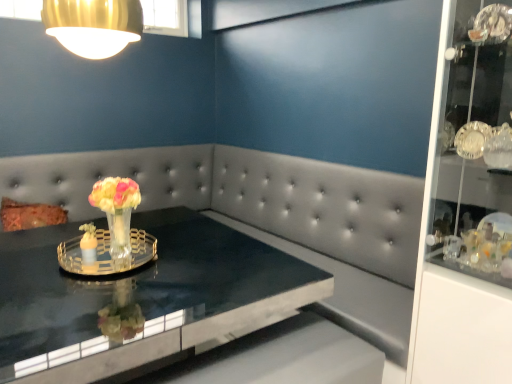
Question: Should I look upward or downward to see clear glass tray at center?

Choices:
 (A) down
 (B) up

Answer: (A)

Question: Does translucent glass vase at center have a lesser height compared to gold metallic lampshade at upper left?

Choices:
 (A) no
 (B) yes

Answer: (A)

Question: Can you see translucent glass vase at center touching gold metallic lampshade at upper left?

Choices:
 (A) yes
 (B) no

Answer: (B)

Question: Considering the relative positions of translucent glass vase at center and gold metallic lampshade at upper left in the image provided, is translucent glass vase at center to the left of gold metallic lampshade at upper left from the viewer's perspective?

Choices:
 (A) no
 (B) yes

Answer: (A)

Question: From the image's perspective, is translucent glass vase at center above gold metallic lampshade at upper left?

Choices:
 (A) yes
 (B) no

Answer: (B)

Question: Is translucent glass vase at center not close to gold metallic lampshade at upper left?

Choices:
 (A) yes
 (B) no

Answer: (B)

Question: Is translucent glass vase at center facing away from gold metallic lampshade at upper left?

Choices:
 (A) yes
 (B) no

Answer: (B)

Question: Is gold metallic lampshade at upper left not close to translucent glass vase at center?

Choices:
 (A) yes
 (B) no

Answer: (B)

Question: Is gold metallic lampshade at upper left facing towards translucent glass vase at center?

Choices:
 (A) yes
 (B) no

Answer: (B)

Question: From the image's perspective, does gold metallic lampshade at upper left appear higher than translucent glass vase at center?

Choices:
 (A) yes
 (B) no

Answer: (A)

Question: Considering the relative sizes of gold metallic lampshade at upper left and translucent glass vase at center in the image provided, is gold metallic lampshade at upper left wider than translucent glass vase at center?

Choices:
 (A) no
 (B) yes

Answer: (B)

Question: Is gold metallic lampshade at upper left positioned with its back to translucent glass vase at center?

Choices:
 (A) no
 (B) yes

Answer: (A)

Question: From a real-world perspective, is gold metallic lampshade at upper left physically below translucent glass vase at center?

Choices:
 (A) yes
 (B) no

Answer: (B)

Question: Does gold metallic lampshade at upper left touch black glossy table at center?

Choices:
 (A) no
 (B) yes

Answer: (A)